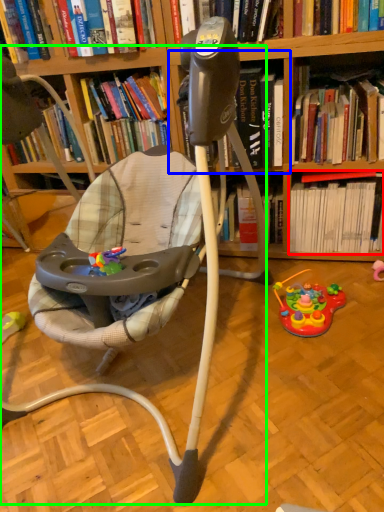
Question: Which object is the farthest from book (highlighted by a red box)? Choose among these: shelf (highlighted by a blue box) or baby carriage (highlighted by a green box).

Choices:
 (A) shelf
 (B) baby carriage

Answer: (B)